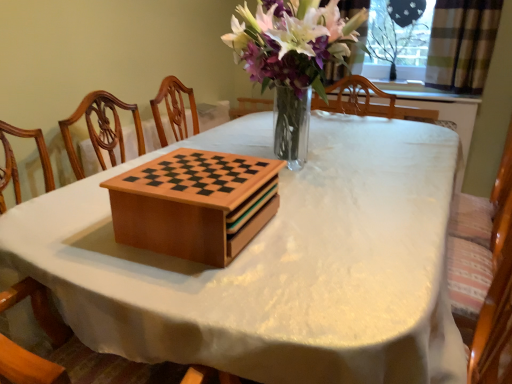
I want to click on wooden chess set at center, so click(x=273, y=264).

This screenshot has width=512, height=384. In order to click on wooden chessboard at center in this screenshot , I will do `click(193, 204)`.

Which object is thinner, wooden chess set at center or transparent plastic screen at upper right?

With smaller width is transparent plastic screen at upper right.

Image resolution: width=512 pixels, height=384 pixels. Find the location of `table below the transparent plastic screen at upper right (from the image's perspective)`. table below the transparent plastic screen at upper right (from the image's perspective) is located at coordinates click(x=273, y=264).

Is wooden chess set at center at the left side of transparent plastic screen at upper right?

Correct, you'll find wooden chess set at center to the left of transparent plastic screen at upper right.

Would you consider wooden chess set at center to be distant from plaid fabric curtain at upper right?

Yes, wooden chess set at center is far from plaid fabric curtain at upper right.

Is wooden chess set at center aimed at plaid fabric curtain at upper right?

No, wooden chess set at center is not turned towards plaid fabric curtain at upper right.

At what (x,y) coordinates should I click in order to perform the action: click on table below the plaid fabric curtain at upper right (from a real-world perspective). Please return your answer as a coordinate pair (x, y). Image resolution: width=512 pixels, height=384 pixels. Looking at the image, I should click on (273, 264).

From their relative heights in the image, would you say wooden chess set at center is taller or shorter than plaid fabric curtain at upper right?

Clearly, wooden chess set at center is taller compared to plaid fabric curtain at upper right.

Considering the relative sizes of plaid fabric curtain at upper right and wooden chess set at center in the image provided, is plaid fabric curtain at upper right smaller than wooden chess set at center?

Yes.

Based on the photo, looking at their sizes, would you say plaid fabric curtain at upper right is wider or thinner than wooden chess set at center?

Clearly, plaid fabric curtain at upper right has less width compared to wooden chess set at center.

Is wooden chess set at center a part of plaid fabric curtain at upper right?

No.

Does plaid fabric curtain at upper right appear on the left side of wooden chess set at center?

No.

Is plaid fabric curtain at upper right located within transparent plastic screen at upper right?

Actually, plaid fabric curtain at upper right is outside transparent plastic screen at upper right.

Which point is more distant from viewer, [405,7] or [432,24]?

Point [405,7]

Is transparent plastic screen at upper right closer to camera compared to plaid fabric curtain at upper right?

No.

Considering the positions of objects transparent plastic screen at upper right and wooden chessboard at center in the image provided, who is in front, transparent plastic screen at upper right or wooden chessboard at center?

wooden chessboard at center is closer to the camera.

Is transparent plastic screen at upper right aimed at wooden chessboard at center?

Yes, transparent plastic screen at upper right is oriented towards wooden chessboard at center.

Looking at this image, is transparent plastic screen at upper right to the left of wooden chessboard at center from the viewer's perspective?

Incorrect, transparent plastic screen at upper right is not on the left side of wooden chessboard at center.

Which is behind, wooden chessboard at center or transparent plastic screen at upper right?

transparent plastic screen at upper right.

Is wooden chessboard at center wider than transparent plastic screen at upper right?

Yes.

Is wooden chessboard at center with transparent plastic screen at upper right?

wooden chessboard at center and transparent plastic screen at upper right are clearly separated.

Does transparent plastic screen at upper right have a smaller size compared to wooden chess set at center?

Correct, transparent plastic screen at upper right occupies less space than wooden chess set at center.

Based on the photo, considering the positions of objects transparent plastic screen at upper right and wooden chess set at center in the image provided, who is more to the left, transparent plastic screen at upper right or wooden chess set at center?

wooden chess set at center.

How different are the orientations of transparent plastic screen at upper right and wooden chess set at center in degrees?

The angular difference between transparent plastic screen at upper right and wooden chess set at center is 177 degrees.

Image resolution: width=512 pixels, height=384 pixels. I want to click on window screen above the wooden chess set at center (from a real-world perspective), so pos(399,31).

I want to click on table below the transparent plastic screen at upper right (from the image's perspective), so click(x=273, y=264).

Image resolution: width=512 pixels, height=384 pixels. There is a wooden chess set at center. What are the coordinates of `curtain above it (from a real-world perspective)` in the screenshot? It's located at (462, 44).

From the image, which object appears to be nearer to wooden chess set at center, wooden chessboard at center or plaid fabric curtain at upper right?

Among the two, wooden chessboard at center is located nearer to wooden chess set at center.

From the image, which object appears to be nearer to transparent plastic screen at upper right, wooden chessboard at center or plaid fabric curtain at upper right?

Based on the image, plaid fabric curtain at upper right appears to be nearer to transparent plastic screen at upper right.

Estimate the real-world distances between objects in this image. Which object is further from wooden chess set at center, wooden chessboard at center or transparent plastic screen at upper right?

The object further to wooden chess set at center is transparent plastic screen at upper right.

Looking at the image, which one is located further to wooden chess set at center, transparent plastic screen at upper right or wooden chessboard at center?

Based on the image, transparent plastic screen at upper right appears to be further to wooden chess set at center.

When comparing their distances from plaid fabric curtain at upper right, does transparent plastic screen at upper right or wooden chessboard at center seem closer?

transparent plastic screen at upper right.

Looking at the image, which one is located further to plaid fabric curtain at upper right, wooden chessboard at center or wooden chess set at center?

wooden chessboard at center is positioned further to the anchor plaid fabric curtain at upper right.

Considering their positions, is wooden chess set at center positioned closer to transparent plastic screen at upper right than wooden chessboard at center?

The object closer to transparent plastic screen at upper right is wooden chess set at center.

Considering their positions, is wooden chess set at center positioned closer to plaid fabric curtain at upper right than transparent plastic screen at upper right?

Based on the image, transparent plastic screen at upper right appears to be nearer to plaid fabric curtain at upper right.

Where is `cardboard box located between wooden chess set at center and plaid fabric curtain at upper right in the depth direction`? cardboard box located between wooden chess set at center and plaid fabric curtain at upper right in the depth direction is located at coordinates (193, 204).

You are a GUI agent. You are given a task and a screenshot of the screen. Output one action in this format:
    pyautogui.click(x=<x>, y=<y>)
    Task: Click on the curtain between wooden chessboard at center and transparent plastic screen at upper right along the z-axis
    The width and height of the screenshot is (512, 384).
    Given the screenshot: What is the action you would take?
    pyautogui.click(x=462, y=44)

This screenshot has width=512, height=384. Find the location of `cardboard box between wooden chess set at center and transparent plastic screen at upper right along the z-axis`. cardboard box between wooden chess set at center and transparent plastic screen at upper right along the z-axis is located at coordinates (193, 204).

At what (x,y) coordinates should I click in order to perform the action: click on curtain between wooden chess set at center and transparent plastic screen at upper right from front to back. Please return your answer as a coordinate pair (x, y). Looking at the image, I should click on (462, 44).